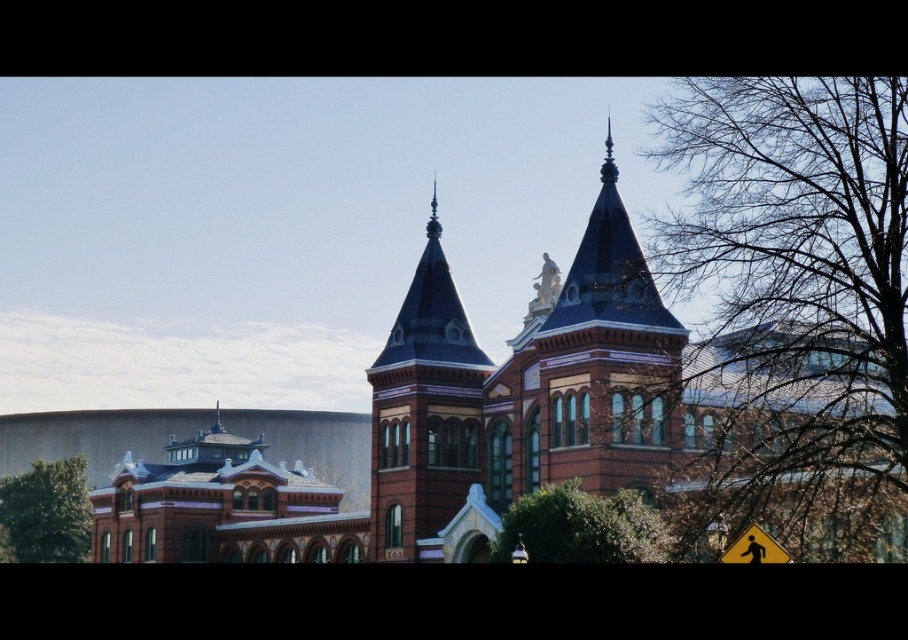
Who is taller, brown brick church at center or shiny dark blue spire at center?

With more height is brown brick church at center.

Describe the element at coordinates (522, 429) in the screenshot. This screenshot has width=908, height=640. I see `brown brick church at center` at that location.

Identify the location of brown brick church at center. The width and height of the screenshot is (908, 640). (522, 429).

Who is lower down, shiny dark blue spire at center or green leafy tree at lower left?

green leafy tree at lower left is below.

Is shiny dark blue spire at center to the right of green leafy tree at lower left from the viewer's perspective?

Correct, you'll find shiny dark blue spire at center to the right of green leafy tree at lower left.

Which is behind, point (425, 540) or point (61, 502)?

The point (61, 502) is more distant.

The width and height of the screenshot is (908, 640). In order to click on shiny dark blue spire at center in this screenshot , I will do `click(425, 416)`.

Is green leafy tree at lower left below yellow reflective plastic pedestrian crossing sign at lower right?

Correct, green leafy tree at lower left is located below yellow reflective plastic pedestrian crossing sign at lower right.

Does green leafy tree at lower left have a lesser height compared to yellow reflective plastic pedestrian crossing sign at lower right?

No, green leafy tree at lower left is not shorter than yellow reflective plastic pedestrian crossing sign at lower right.

Find the location of `green leafy tree at lower left`. green leafy tree at lower left is located at coordinates (45, 513).